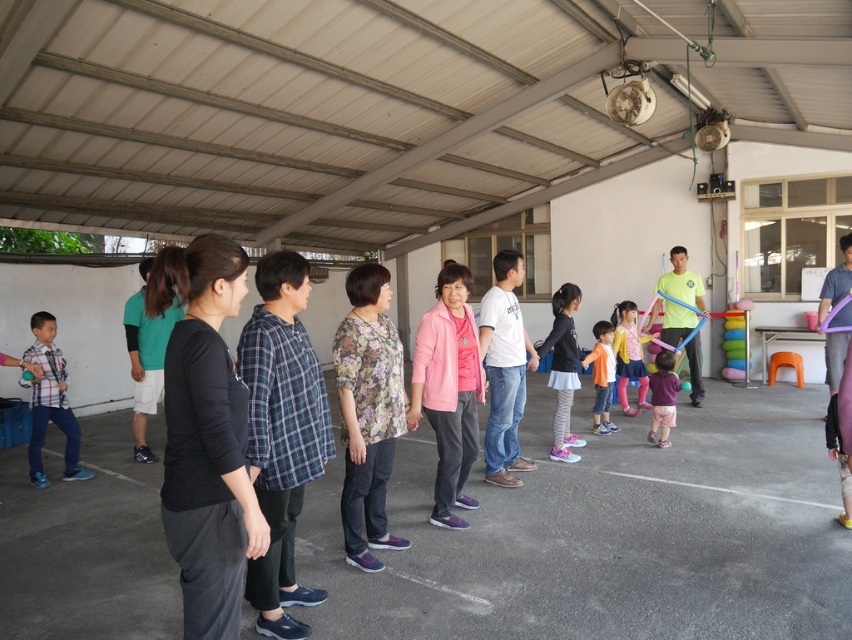
Does black matte shirt at center appear over plaid fabric shirt at left?

Indeed, black matte shirt at center is positioned over plaid fabric shirt at left.

The height and width of the screenshot is (640, 852). I want to click on black matte shirt at center, so click(x=205, y=435).

You are a GUI agent. You are given a task and a screenshot of the screen. Output one action in this format:
    pyautogui.click(x=<x>, y=<y>)
    Task: Click on the black matte shirt at center
    
    Given the screenshot: What is the action you would take?
    pyautogui.click(x=205, y=435)

Is black matte shirt at center above pastel pink leggings at center?

Yes, black matte shirt at center is above pastel pink leggings at center.

Which of these two, black matte shirt at center or pastel pink leggings at center, stands shorter?

pastel pink leggings at center is shorter.

Is point (199, 621) farther from camera compared to point (631, 376)?

No, it is not.

Where is `black matte shirt at center`? black matte shirt at center is located at coordinates (205, 435).

Consider the image. Between plaid fabric shirt at left and purple matte dress at center, which one appears on the left side from the viewer's perspective?

plaid fabric shirt at left is more to the left.

Identify the location of plaid fabric shirt at left. The height and width of the screenshot is (640, 852). (49, 403).

Is point (68, 442) farther from camera compared to point (659, 387)?

No, (68, 442) is closer to viewer.

You are a GUI agent. You are given a task and a screenshot of the screen. Output one action in this format:
    pyautogui.click(x=<x>, y=<y>)
    Task: Click on the plaid fabric shirt at left
    The width and height of the screenshot is (852, 640).
    Given the screenshot: What is the action you would take?
    pyautogui.click(x=49, y=403)